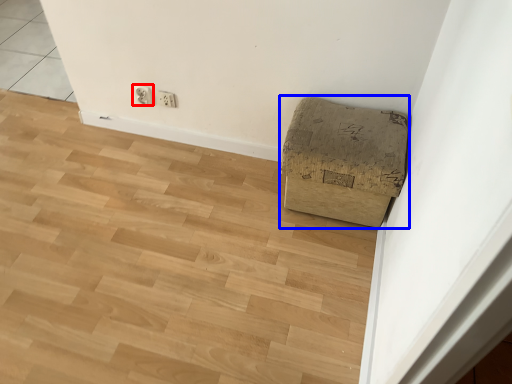
Question: Which object is further to the camera taking this photo, electric outlet (highlighted by a red box) or furniture (highlighted by a blue box)?

Choices:
 (A) electric outlet
 (B) furniture

Answer: (A)